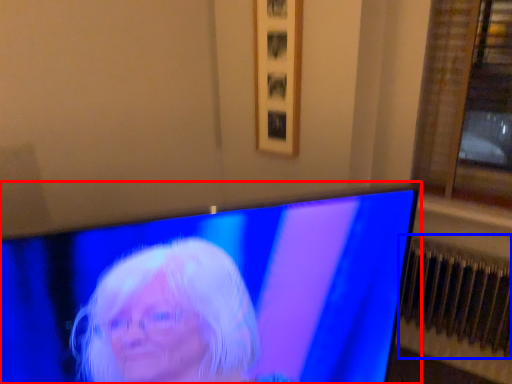
Question: Which object appears farthest to the camera in this image, television (highlighted by a red box) or radiator (highlighted by a blue box)?

Choices:
 (A) television
 (B) radiator

Answer: (B)